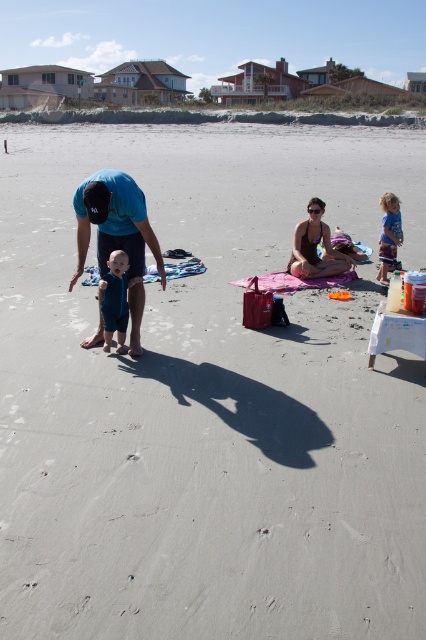
From the picture: Can you confirm if blue fabric shirt at center is bigger than pink fabric blanket at center?

Yes, blue fabric shirt at center is bigger than pink fabric blanket at center.

Based on the photo, which is below, blue fabric shirt at center or pink fabric blanket at center?

Positioned lower is blue fabric shirt at center.

Image resolution: width=426 pixels, height=640 pixels. In order to click on blue fabric shirt at center in this screenshot , I will do `click(114, 221)`.

How much distance is there between blue denim shorts at center and blue woven towel at center?

A distance of 2.34 meters exists between blue denim shorts at center and blue woven towel at center.

This screenshot has height=640, width=426. Describe the element at coordinates (115, 300) in the screenshot. I see `blue denim shorts at center` at that location.

Image resolution: width=426 pixels, height=640 pixels. I want to click on blue denim shorts at center, so click(x=115, y=300).

Describe the element at coordinates (114, 221) in the screenshot. The width and height of the screenshot is (426, 640). I see `blue fabric shirt at center` at that location.

Is blue fabric shirt at center to the right of blue striped shorts at right from the viewer's perspective?

Incorrect, blue fabric shirt at center is not on the right side of blue striped shorts at right.

Is point (127, 273) positioned before point (382, 282)?

That is True.

Identify the location of blue fabric shirt at center. The image size is (426, 640). (114, 221).